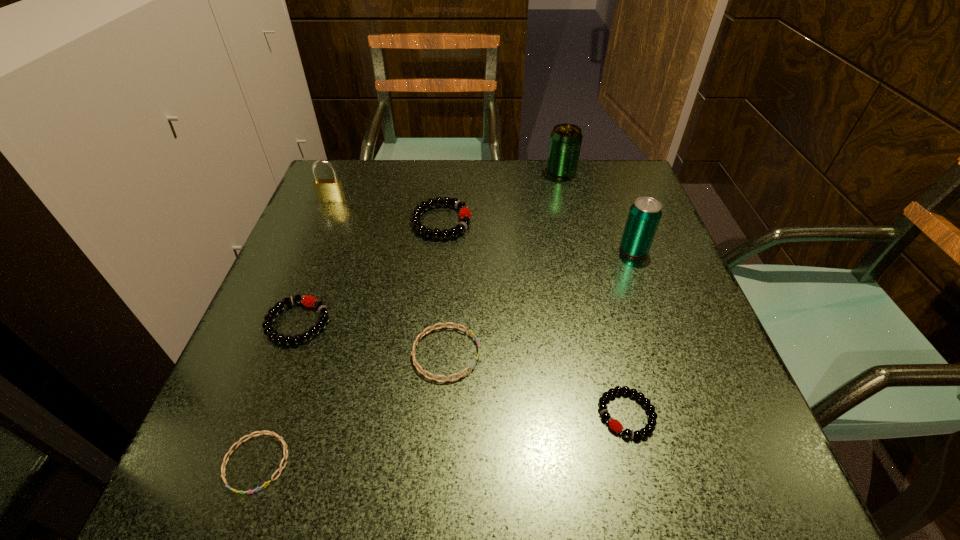
Locate an element on the screen. Image resolution: width=960 pixels, height=540 pixels. empty space that is in between the nearer blue bracelet and the fourth tallest object is located at coordinates (349, 342).

You are a GUI agent. You are given a task and a screenshot of the screen. Output one action in this format:
    pyautogui.click(x=<x>, y=<y>)
    Task: Click on the free area in between the farthest object and the second smallest black bracelet
    Image resolution: width=960 pixels, height=540 pixels.
    Given the screenshot: What is the action you would take?
    pyautogui.click(x=430, y=247)

At what (x,y) coordinates should I click in order to perform the action: click on vacant space that's between the left beer can and the right blue bracelet. Please return your answer as a coordinate pair (x, y). Looking at the image, I should click on (504, 263).

The width and height of the screenshot is (960, 540). I want to click on free spot between the farther beer can and the brass padlock, so click(x=446, y=186).

Locate an element on the screen. The width and height of the screenshot is (960, 540). free space between the seventh nearest object and the rightmost bracelet is located at coordinates (479, 307).

You are a GUI agent. You are given a task and a screenshot of the screen. Output one action in this format:
    pyautogui.click(x=<x>, y=<y>)
    Task: Click on the unoccupied area between the right beer can and the left beer can
    Image resolution: width=960 pixels, height=540 pixels.
    Given the screenshot: What is the action you would take?
    pyautogui.click(x=597, y=211)

Find the location of a particular element. This screenshot has width=960, height=540. empty location between the farthest object and the padlock is located at coordinates (446, 186).

Find the location of a particular element. free spot between the second biggest black bracelet and the tallest bracelet is located at coordinates (370, 272).

What are the coordinates of `object identified as the fourth closest to the padlock` in the screenshot? It's located at (565, 143).

Find the location of a particular element. Image resolution: width=960 pixels, height=540 pixels. object that is the fifth nearest to the right blue bracelet is located at coordinates (644, 216).